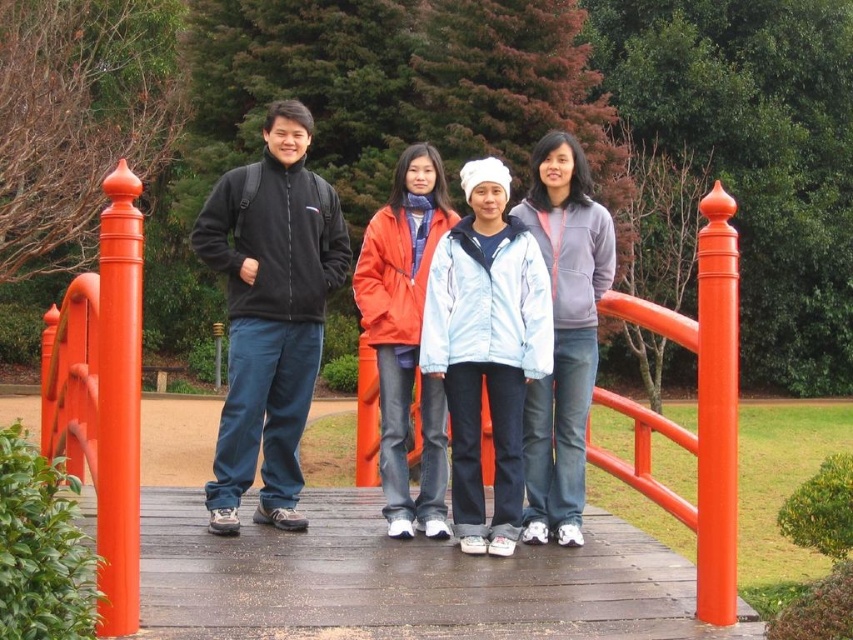
Does light blue fleece jacket at center appear on the left side of gray fleece jacket at center?

Correct, you'll find light blue fleece jacket at center to the left of gray fleece jacket at center.

Measure the distance from light blue fleece jacket at center to gray fleece jacket at center.

They are 13.92 inches apart.

At what (x,y) coordinates should I click in order to perform the action: click on light blue fleece jacket at center. Please return your answer as a coordinate pair (x, y). Image resolution: width=853 pixels, height=640 pixels. Looking at the image, I should click on (486, 348).

This screenshot has height=640, width=853. I want to click on light blue fleece jacket at center, so [x=486, y=348].

Does black fleece jacket at left appear under orange matte jacket at center?

No.

This screenshot has height=640, width=853. I want to click on black fleece jacket at left, so click(270, 314).

This screenshot has width=853, height=640. What are the coordinates of `black fleece jacket at left` in the screenshot? It's located at (270, 314).

Can you confirm if light blue fleece jacket at center is wider than orange matte jacket at center?

Indeed, light blue fleece jacket at center has a greater width compared to orange matte jacket at center.

Is light blue fleece jacket at center in front of orange matte jacket at center?

Yes.

Between point (476, 264) and point (407, 435), which one is positioned behind?

Positioned behind is point (407, 435).

The height and width of the screenshot is (640, 853). What are the coordinates of `light blue fleece jacket at center` in the screenshot? It's located at (486, 348).